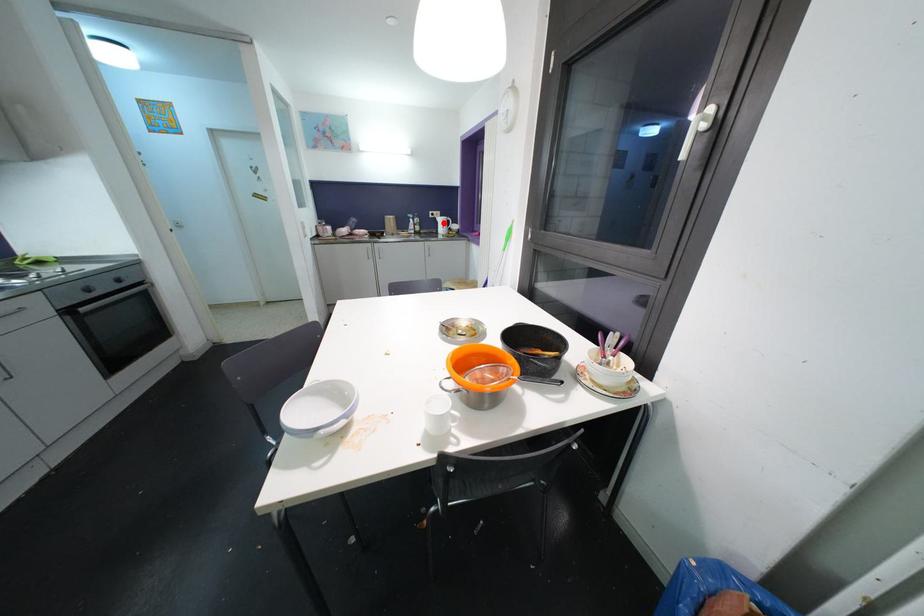
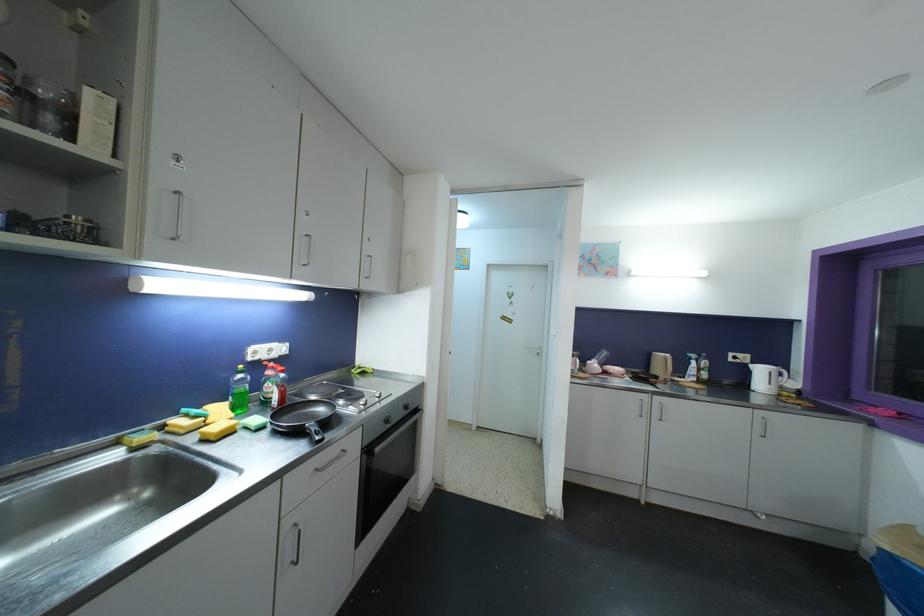
Question: A red point is marked in image1. In image2, is the corresponding 3D point closer to the camera or farther? Reply with the corresponding letter.

Choices:
 (A) The corresponding 3D point is closer.
 (B) The corresponding 3D point is farther.

Answer: (B)